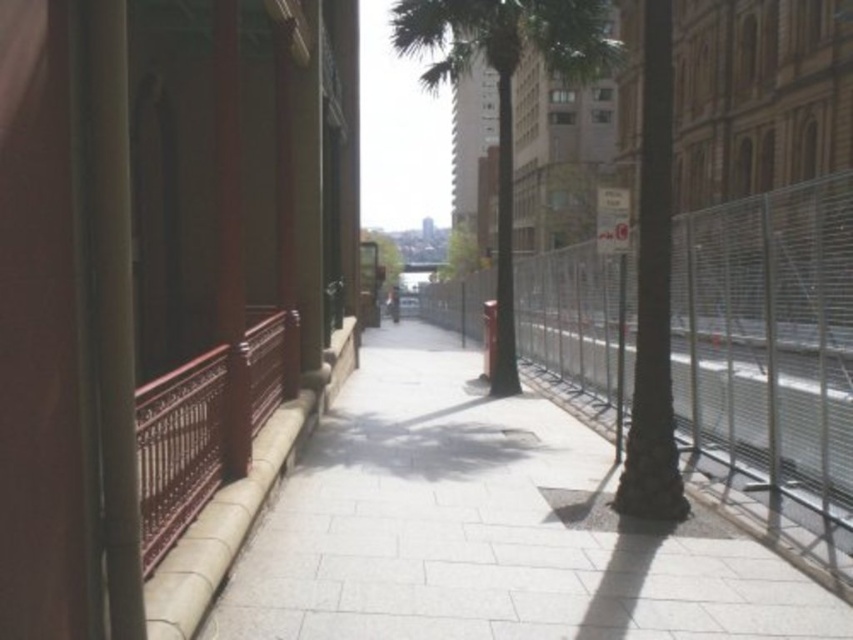
Is metallic chain-link fence at center-right thinner than green leafy palm tree at center?

Yes.

This screenshot has height=640, width=853. Describe the element at coordinates (770, 365) in the screenshot. I see `metallic chain-link fence at center-right` at that location.

Identify the location of metallic chain-link fence at center-right. This screenshot has width=853, height=640. (770, 365).

Between point (477, 506) and point (773, 362), which one is positioned in front?

Positioned in front is point (477, 506).

From the picture: Who is higher up, white stone pavement at center or metallic chain-link fence at center-right?

metallic chain-link fence at center-right is above.

This screenshot has height=640, width=853. I want to click on white stone pavement at center, so click(x=486, y=529).

Find the location of a particular element. white stone pavement at center is located at coordinates (486, 529).

Is white stone pavement at center wider than green leafy palm tree at center?

Incorrect, white stone pavement at center's width does not surpass green leafy palm tree at center's.

Does white stone pavement at center have a lesser width compared to green leafy palm tree at center?

Yes, white stone pavement at center is thinner than green leafy palm tree at center.

At what (x,y) coordinates should I click in order to perform the action: click on white stone pavement at center. Please return your answer as a coordinate pair (x, y). Looking at the image, I should click on (486, 529).

I want to click on white stone pavement at center, so click(x=486, y=529).